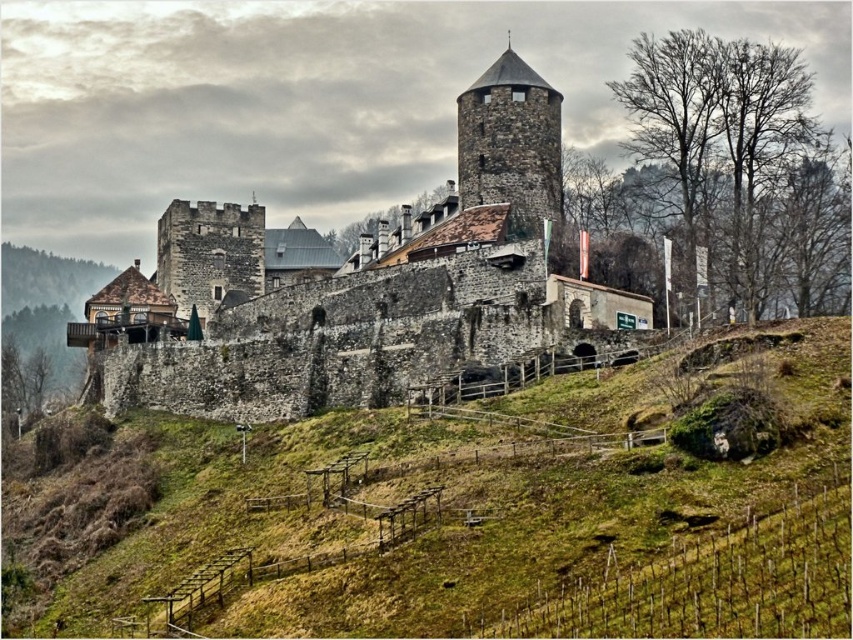
Can you confirm if green grassy vineyard at lower center is wider than stone wall at center?

Indeed, green grassy vineyard at lower center has a greater width compared to stone wall at center.

Between green grassy vineyard at lower center and stone wall at center, which one appears on the left side from the viewer's perspective?

stone wall at center is more to the left.

Is point (708, 600) positioned after point (259, 353)?

No.

Where is `green grassy vineyard at lower center`? The height and width of the screenshot is (640, 853). green grassy vineyard at lower center is located at coordinates (473, 522).

Does point (358, 364) come in front of point (471, 113)?

Yes, point (358, 364) is in front of point (471, 113).

Is point (540, 346) positioned in front of point (466, 148)?

Yes.

Where is `stone wall at center`? Image resolution: width=853 pixels, height=640 pixels. stone wall at center is located at coordinates (370, 285).

Is green grassy vineyard at lower center positioned in front of rustic stone tower at center?

Yes.

Is point (492, 561) positioned behind point (524, 211)?

No, it is in front of (524, 211).

Is point (311, 554) positioned before point (491, 147)?

Yes, point (311, 554) is closer to viewer.

Where is `green grassy vineyard at lower center`? This screenshot has width=853, height=640. green grassy vineyard at lower center is located at coordinates (473, 522).